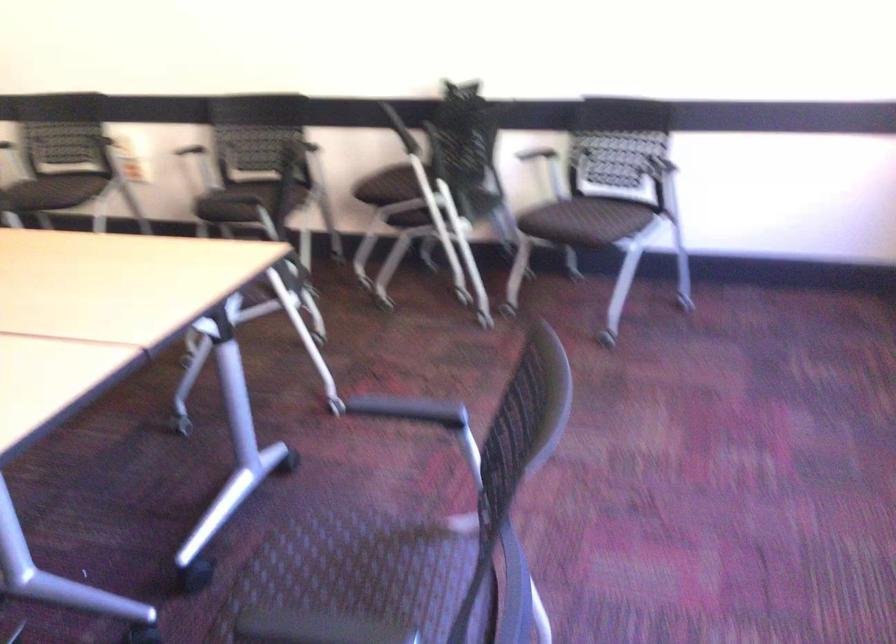
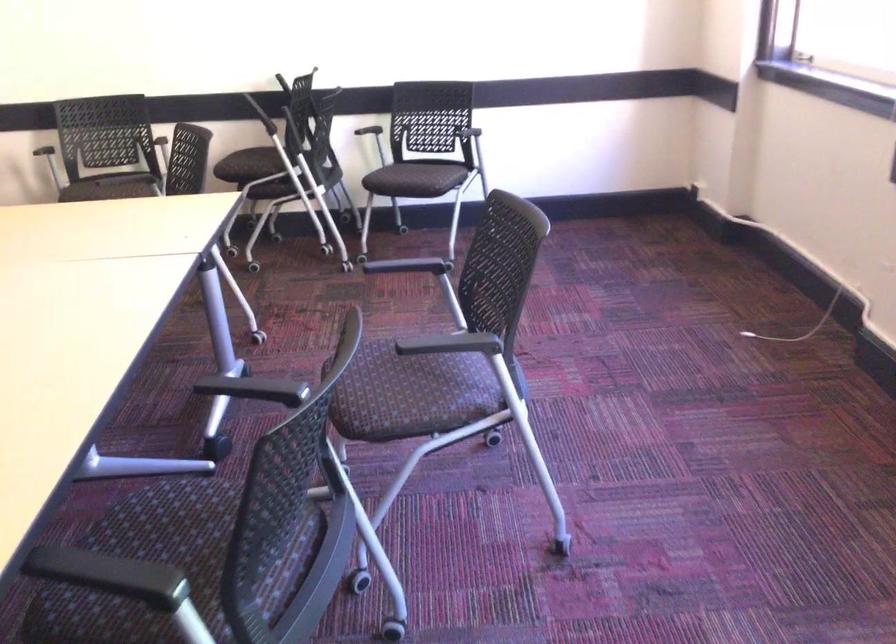
The point at (x=579, y=230) is marked in the first image. Where is the corresponding point in the second image?

(415, 178)